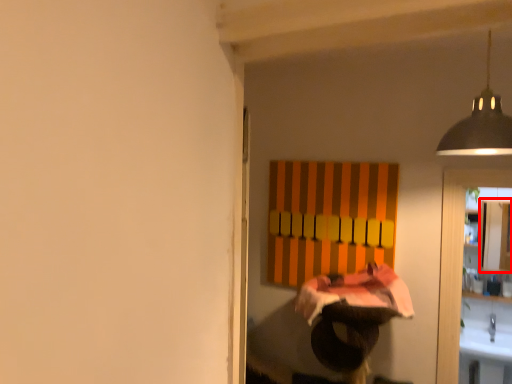
Question: From the image, what is the correct spatial relationship of cabinetry (annotated by the red box) in relation to lamp?

Choices:
 (A) right
 (B) left

Answer: (A)